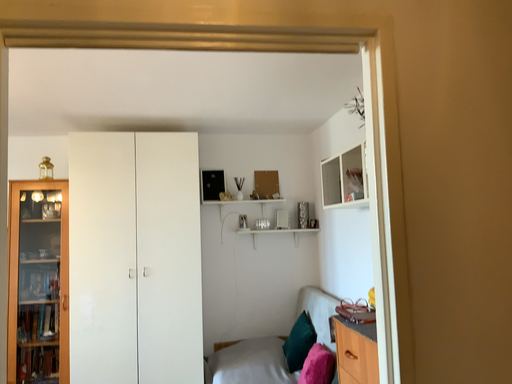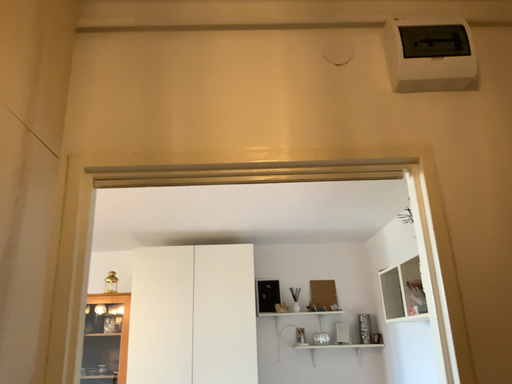
Question: Which way did the camera rotate in the video?

Choices:
 (A) rotated left
 (B) rotated right

Answer: (A)